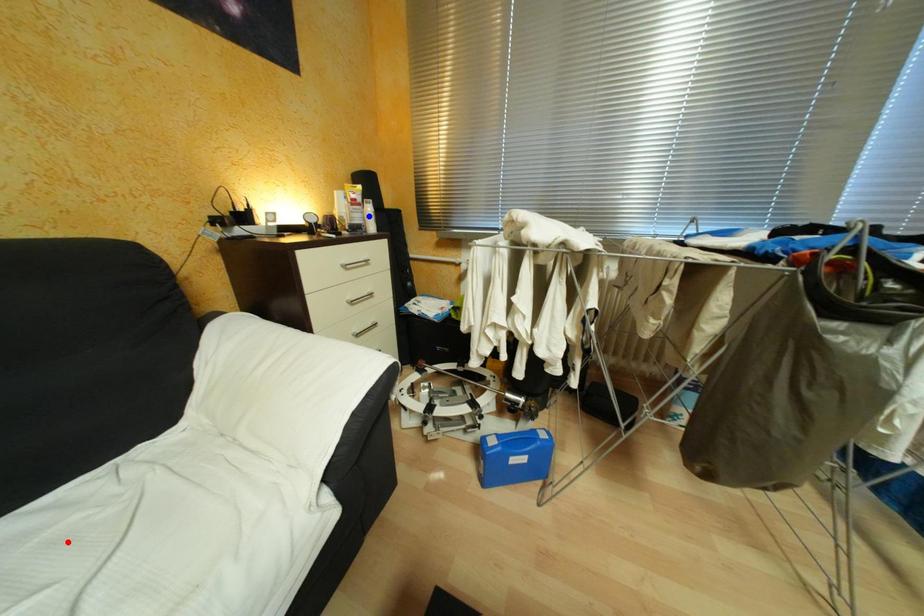
Question: Two points are marked on the image. Which point is closer to the camera?

Choices:
 (A) Blue point is closer.
 (B) Red point is closer.

Answer: (B)